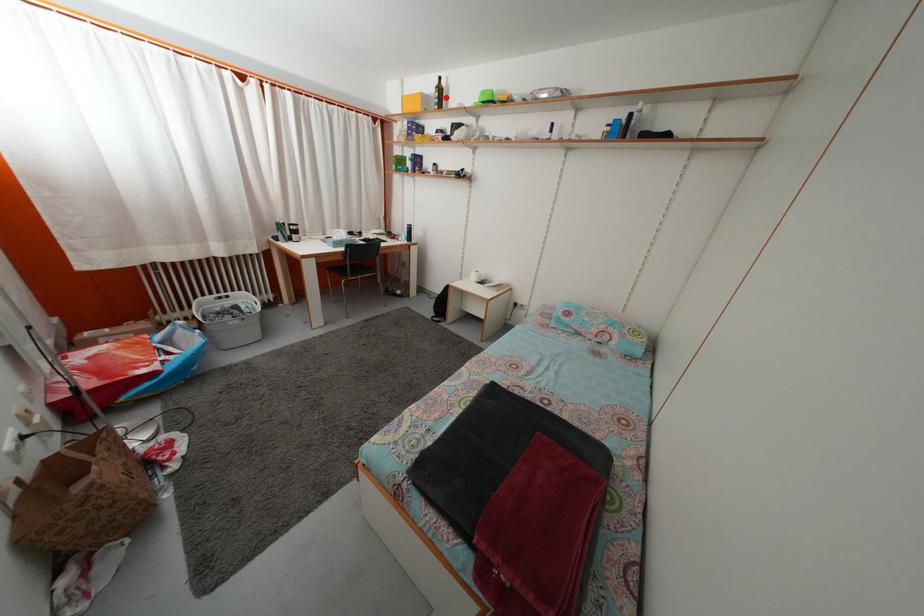
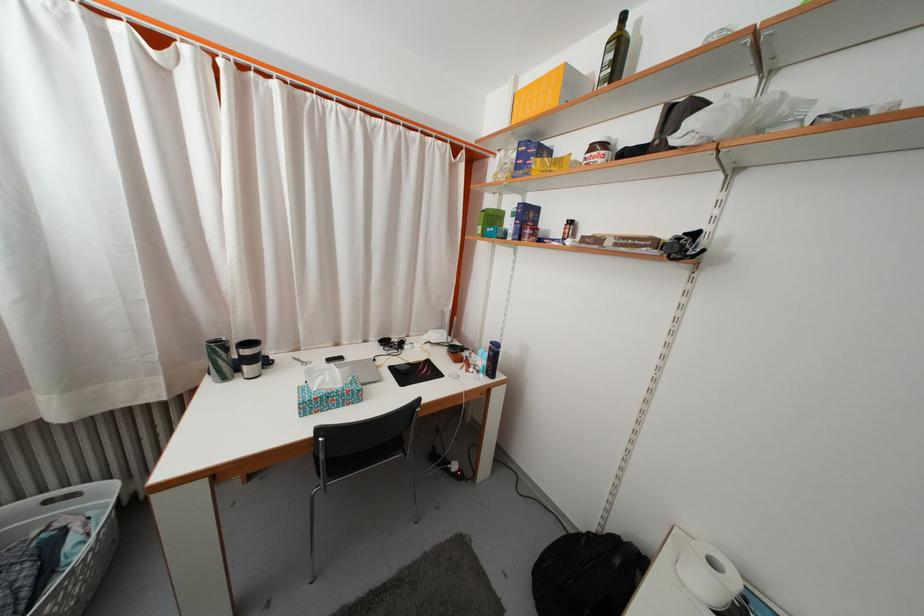
Locate, in the second image, the point that corresponds to the highlighted location in the first image.

(625, 54)